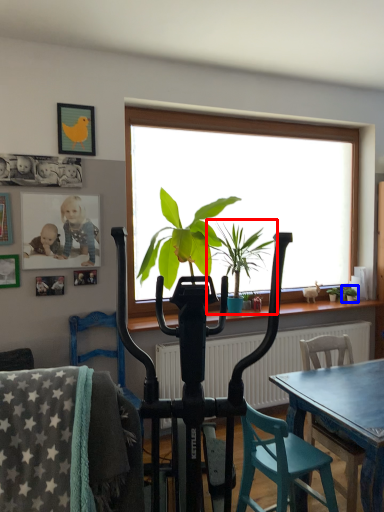
Question: Which point is further to the camera, houseplant (highlighted by a red box) or houseplant (highlighted by a blue box)?

Choices:
 (A) houseplant
 (B) houseplant

Answer: (B)